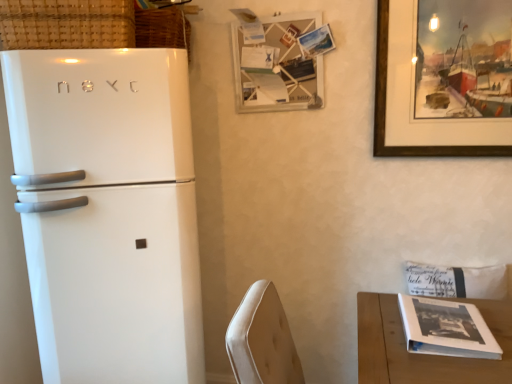
Question: Does wooden picture frame at upper center, which is the second picture frame from right to left, appear on the right side of wooden framed painting at upper right, acting as the second picture frame starting from the left?

Choices:
 (A) no
 (B) yes

Answer: (A)

Question: From a real-world perspective, is wooden picture frame at upper center, which is the second picture frame from right to left, physically below wooden framed painting at upper right, the first picture frame viewed from the right?

Choices:
 (A) yes
 (B) no

Answer: (B)

Question: Is wooden picture frame at upper center, the 1th picture frame from the left, smaller than wooden framed painting at upper right, the first picture frame viewed from the right?

Choices:
 (A) no
 (B) yes

Answer: (A)

Question: Is wooden picture frame at upper center, the 1th picture frame from the left, taller than wooden framed painting at upper right, acting as the second picture frame starting from the left?

Choices:
 (A) yes
 (B) no

Answer: (B)

Question: Is wooden picture frame at upper center, which is the second picture frame from right to left, not within wooden framed painting at upper right, the first picture frame viewed from the right?

Choices:
 (A) yes
 (B) no

Answer: (A)

Question: Based on their positions, is woven straw basket at upper left, the first basket viewed from the back, located to the left or right of white wood table at lower right?

Choices:
 (A) left
 (B) right

Answer: (A)

Question: Looking at their shapes, would you say woven straw basket at upper left, marked as the 2th basket in a front-to-back arrangement, is wider or thinner than white wood table at lower right?

Choices:
 (A) thin
 (B) wide

Answer: (A)

Question: Does point (182, 39) appear closer or farther from the camera than point (372, 334)?

Choices:
 (A) closer
 (B) farther

Answer: (B)

Question: Considering the positions of woven straw basket at upper left, marked as the 2th basket in a front-to-back arrangement, and white wood table at lower right in the image, is woven straw basket at upper left, marked as the 2th basket in a front-to-back arrangement, taller or shorter than white wood table at lower right?

Choices:
 (A) tall
 (B) short

Answer: (B)

Question: From their relative heights in the image, would you say white glossy refrigerator at left is taller or shorter than woven straw basket at upper left, marked as the 2th basket in a front-to-back arrangement?

Choices:
 (A) short
 (B) tall

Answer: (B)

Question: Choose the correct answer: Is white glossy refrigerator at left inside woven straw basket at upper left, marked as the 2th basket in a front-to-back arrangement, or outside it?

Choices:
 (A) outside
 (B) inside

Answer: (A)

Question: Would you say white glossy refrigerator at left is to the left or to the right of woven straw basket at upper left, marked as the 2th basket in a front-to-back arrangement, in the picture?

Choices:
 (A) left
 (B) right

Answer: (A)

Question: Is white glossy refrigerator at left bigger or smaller than woven straw basket at upper left, the first basket viewed from the back?

Choices:
 (A) small
 (B) big

Answer: (B)

Question: From their relative heights in the image, would you say woven straw basket at upper left, the first basket viewed from the back, is taller or shorter than white glossy refrigerator at left?

Choices:
 (A) short
 (B) tall

Answer: (A)

Question: Looking at their shapes, would you say woven straw basket at upper left, marked as the 2th basket in a front-to-back arrangement, is wider or thinner than white glossy refrigerator at left?

Choices:
 (A) wide
 (B) thin

Answer: (B)